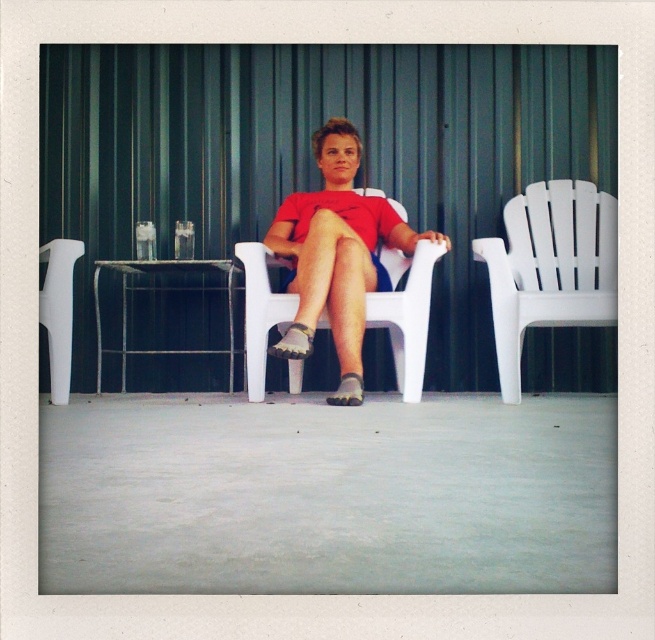
Question: Which object appears farthest from the camera in this image?

Choices:
 (A) white plastic chair at left
 (B) white plastic chair at center

Answer: (A)

Question: Estimate the real-world distances between objects in this image. Which object is farther from the white plastic chair at center?

Choices:
 (A) white plastic chair at right
 (B) white plastic chair at left

Answer: (B)

Question: Considering the relative positions of white plastic chair at right and white plastic chair at left in the image provided, where is white plastic chair at right located with respect to white plastic chair at left?

Choices:
 (A) above
 (B) below

Answer: (A)

Question: Does white plastic chair at right have a lesser width compared to white plastic chair at center?

Choices:
 (A) no
 (B) yes

Answer: (B)

Question: Which object is positioned closest to the white plastic chair at right?

Choices:
 (A) white plastic chair at center
 (B) white plastic chair at left

Answer: (A)

Question: Is white plastic chair at center wider than white plastic chair at left?

Choices:
 (A) yes
 (B) no

Answer: (A)